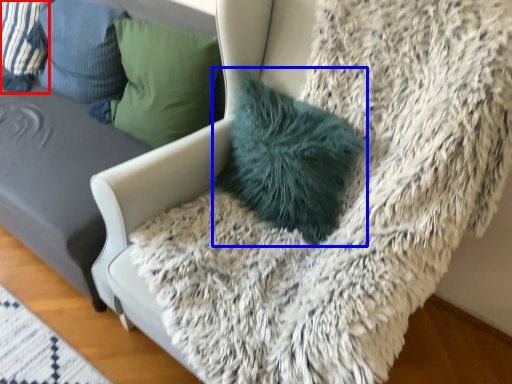
Question: Which object appears closest to the camera in this image, pillow (highlighted by a red box) or pillow (highlighted by a blue box)?

Choices:
 (A) pillow
 (B) pillow

Answer: (B)